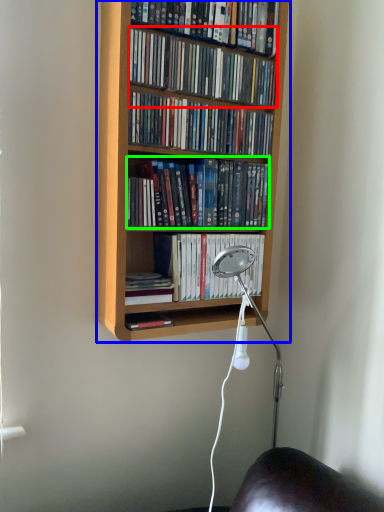
Question: Estimate the real-world distances between objects in this image. Which object is closer to book (highlighted by a red box), bookcase (highlighted by a blue box) or book (highlighted by a green box)?

Choices:
 (A) bookcase
 (B) book

Answer: (A)